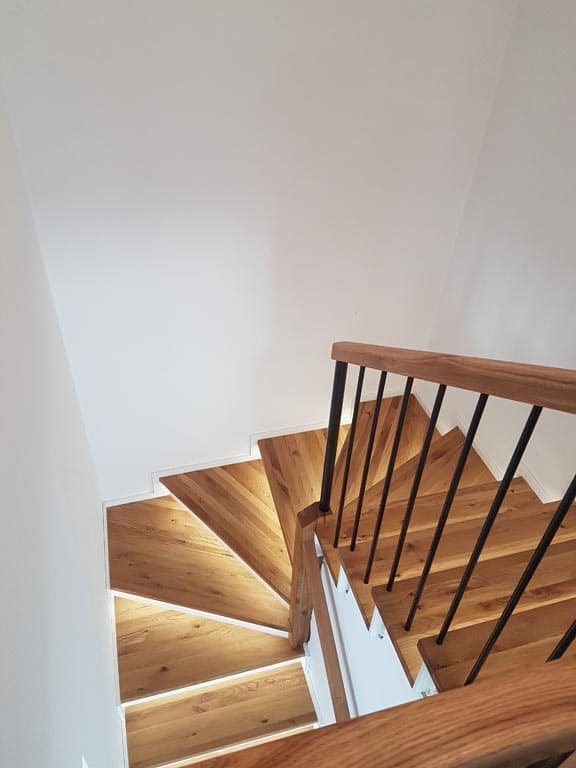
Find the location of a particular element. The height and width of the screenshot is (768, 576). front facing stair step risers is located at coordinates (210, 530), (192, 610), (210, 679), (229, 746).